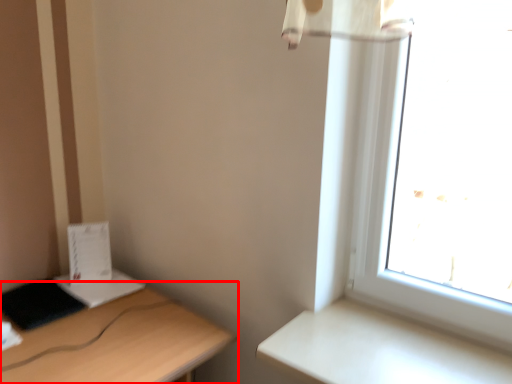
Question: From the image's perspective, what is the correct spatial relationship of desk (annotated by the red box) in relation to table?

Choices:
 (A) below
 (B) above

Answer: (A)